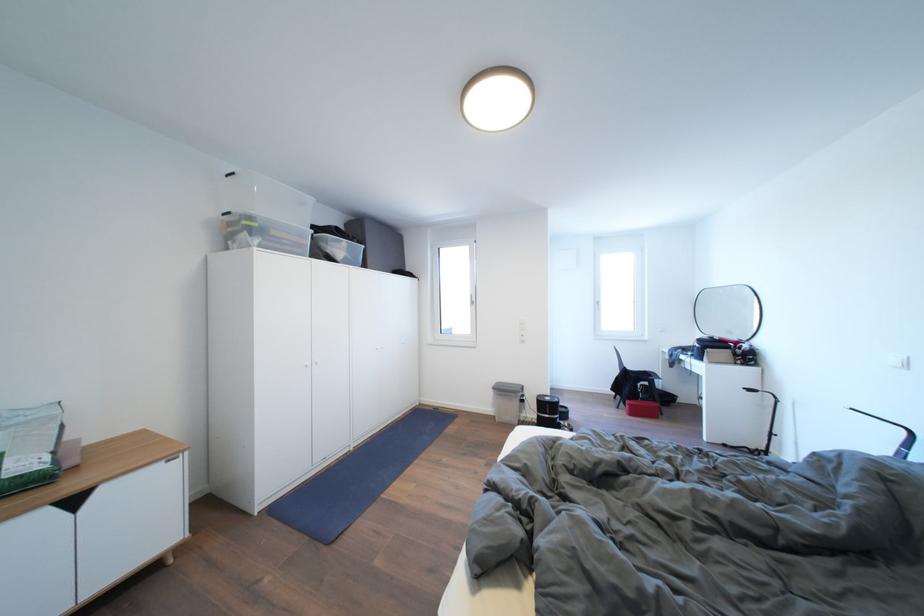
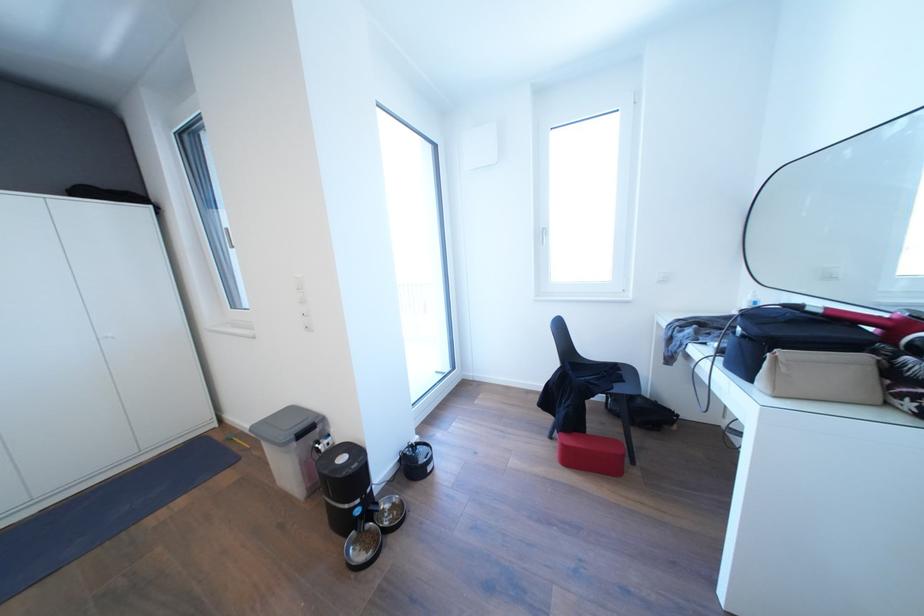
The images are taken continuously from a first-person perspective. In which direction are you moving?

The movement direction of the cameraman is right, forward.